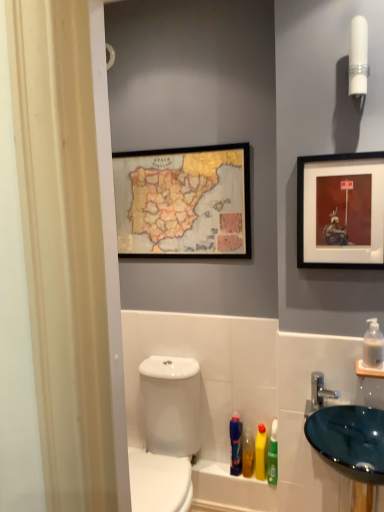
The width and height of the screenshot is (384, 512). I want to click on translucent green mouthwash at lower right, arranged as the 4th mouthwash when viewed from the right, so click(236, 445).

Describe the element at coordinates (358, 61) in the screenshot. I see `white plastic tube at upper right` at that location.

Where is `white plastic tube at upper right`? This screenshot has width=384, height=512. white plastic tube at upper right is located at coordinates (358, 61).

This screenshot has height=512, width=384. What do you see at coordinates (210, 389) in the screenshot? I see `white glossy toilet at lower left` at bounding box center [210, 389].

Where is `white glossy toilet at lower left`? The height and width of the screenshot is (512, 384). white glossy toilet at lower left is located at coordinates (210, 389).

Where is `matte black picture frame at upper right, the first picture frame in the front-to-back sequence`? The width and height of the screenshot is (384, 512). matte black picture frame at upper right, the first picture frame in the front-to-back sequence is located at coordinates (340, 211).

What do you see at coordinates (340, 211) in the screenshot? This screenshot has height=512, width=384. I see `matte black picture frame at upper right, acting as the second picture frame starting from the back` at bounding box center [340, 211].

Image resolution: width=384 pixels, height=512 pixels. Identify the location of translucent plastic mouthwash at lower right, which is the second mouthwash in left-to-right order. (248, 454).

Where is `translucent green mouthwash at lower right, acting as the 2th mouthwash starting from the back`? This screenshot has height=512, width=384. translucent green mouthwash at lower right, acting as the 2th mouthwash starting from the back is located at coordinates (236, 445).

Which is in front, clear plastic pump at right, the fourth mouthwash from the bottom, or green plastic mouthwash at lower center, the 3th mouthwash in the left-to-right sequence?

clear plastic pump at right, the fourth mouthwash from the bottom.

Between clear plastic pump at right, the fourth mouthwash in the left-to-right sequence, and green plastic mouthwash at lower center, the 2th mouthwash viewed from the right, which one has larger width?

Wider between the two is green plastic mouthwash at lower center, the 2th mouthwash viewed from the right.

Which is more to the right, clear plastic pump at right, the fourth mouthwash in the left-to-right sequence, or green plastic mouthwash at lower center, positioned as the 2th mouthwash in front-to-back order?

clear plastic pump at right, the fourth mouthwash in the left-to-right sequence, is more to the right.

Who is shorter, clear plastic pump at right, the fourth mouthwash from the bottom, or green plastic mouthwash at lower center, the 2th mouthwash viewed from the right?

With less height is clear plastic pump at right, the fourth mouthwash from the bottom.

Who is taller, green plastic mouthwash at lower center, the 2th mouthwash viewed from the right, or yellow matte bottle at lower center?

green plastic mouthwash at lower center, the 2th mouthwash viewed from the right, is taller.

Would you consider green plastic mouthwash at lower center, positioned as the third mouthwash in back-to-front order, to be distant from yellow matte bottle at lower center?

No, green plastic mouthwash at lower center, positioned as the third mouthwash in back-to-front order, is not far from yellow matte bottle at lower center.

The image size is (384, 512). Identify the location of cleaning product located below the green plastic mouthwash at lower center, positioned as the third mouthwash in back-to-front order (from the image's perspective). (260, 452).

Considering the positions of objects green plastic mouthwash at lower center, the 3th mouthwash from the top, and yellow matte bottle at lower center in the image provided, who is in front, green plastic mouthwash at lower center, the 3th mouthwash from the top, or yellow matte bottle at lower center?

green plastic mouthwash at lower center, the 3th mouthwash from the top, is closer to the camera.

Who is smaller, clear plastic pump at right, positioned as the 1th mouthwash in top-to-bottom order, or white plastic tube at upper right?

clear plastic pump at right, positioned as the 1th mouthwash in top-to-bottom order, is smaller.

From the image's perspective, which is above, clear plastic pump at right, the first mouthwash in the front-to-back sequence, or white plastic tube at upper right?

white plastic tube at upper right.

Looking at this image, considering the sizes of objects clear plastic pump at right, positioned as the 4th mouthwash in back-to-front order, and white plastic tube at upper right in the image provided, who is taller, clear plastic pump at right, positioned as the 4th mouthwash in back-to-front order, or white plastic tube at upper right?

With more height is white plastic tube at upper right.

Where is `the 1st mouthwash directly beneath the white plastic tube at upper right (from a real-world perspective)`? Image resolution: width=384 pixels, height=512 pixels. the 1st mouthwash directly beneath the white plastic tube at upper right (from a real-world perspective) is located at coordinates (373, 345).

Is point (269, 451) closer or farther from the camera than point (365, 79)?

Clearly, point (269, 451) is more distant from the camera than point (365, 79).

Locate an element on the screen. light fixture above the green plastic mouthwash at lower center, the 3th mouthwash from the top (from the image's perspective) is located at coordinates (358, 61).

Is green plastic mouthwash at lower center, positioned as the 2th mouthwash in front-to-back order, not close to white plastic tube at upper right?

Absolutely, green plastic mouthwash at lower center, positioned as the 2th mouthwash in front-to-back order, is distant from white plastic tube at upper right.

From the image's perspective, which is below, green plastic mouthwash at lower center, acting as the second mouthwash starting from the bottom, or white plastic tube at upper right?

green plastic mouthwash at lower center, acting as the second mouthwash starting from the bottom, appears lower in the image.

From the picture: From their relative heights in the image, would you say yellow matte bottle at lower center is taller or shorter than wooden framed map at upper center, marked as the 2th picture frame in a front-to-back arrangement?

In the image, yellow matte bottle at lower center appears to be shorter than wooden framed map at upper center, marked as the 2th picture frame in a front-to-back arrangement.

Is yellow matte bottle at lower center at the left side of wooden framed map at upper center, marked as the 2th picture frame in a front-to-back arrangement?

Incorrect, yellow matte bottle at lower center is not on the left side of wooden framed map at upper center, marked as the 2th picture frame in a front-to-back arrangement.

Consider the image. Relative to wooden framed map at upper center, arranged as the 2th picture frame when viewed from the right, is yellow matte bottle at lower center in front or behind?

Visually, yellow matte bottle at lower center is located behind wooden framed map at upper center, arranged as the 2th picture frame when viewed from the right.

Locate an element on the screen. The image size is (384, 512). the 1st picture frame in front of the yellow matte bottle at lower center is located at coordinates (184, 202).

From a real-world perspective, between wooden framed map at upper center, marked as the 2th picture frame in a front-to-back arrangement, and translucent plastic mouthwash at lower right, which is the second mouthwash in left-to-right order, who is vertically higher?

In real-world perspective, wooden framed map at upper center, marked as the 2th picture frame in a front-to-back arrangement, is above.

Is wooden framed map at upper center, marked as the 2th picture frame in a front-to-back arrangement, facing towards translucent plastic mouthwash at lower right, which is counted as the 3th mouthwash, starting from the right?

No, wooden framed map at upper center, marked as the 2th picture frame in a front-to-back arrangement, is not facing towards translucent plastic mouthwash at lower right, which is counted as the 3th mouthwash, starting from the right.

Does wooden framed map at upper center, marked as the 2th picture frame in a front-to-back arrangement, lie in front of translucent plastic mouthwash at lower right, which is the second mouthwash in left-to-right order?

That is True.

Would you say wooden framed map at upper center, which appears as the 1th picture frame when viewed from the left, is to the left or to the right of translucent plastic mouthwash at lower right, marked as the fourth mouthwash in a top-to-bottom arrangement, in the picture?

Based on their positions, wooden framed map at upper center, which appears as the 1th picture frame when viewed from the left, is located to the left of translucent plastic mouthwash at lower right, marked as the fourth mouthwash in a top-to-bottom arrangement.

Is point (373, 355) farther from viewer compared to point (240, 456)?

No, it is in front of (240, 456).

Where is `mouthwash that is the 1st object directly below the clear plastic pump at right, the fourth mouthwash in the left-to-right sequence (from a real-world perspective)`? Image resolution: width=384 pixels, height=512 pixels. mouthwash that is the 1st object directly below the clear plastic pump at right, the fourth mouthwash in the left-to-right sequence (from a real-world perspective) is located at coordinates (236, 445).

Looking at this image, from the image's perspective, is clear plastic pump at right, positioned as the 1th mouthwash in top-to-bottom order, positioned above or below translucent green mouthwash at lower right, acting as the 2th mouthwash starting from the back?

From the image's perspective, clear plastic pump at right, positioned as the 1th mouthwash in top-to-bottom order, appears above translucent green mouthwash at lower right, acting as the 2th mouthwash starting from the back.

Does clear plastic pump at right, the first mouthwash in the front-to-back sequence, have a greater width compared to translucent green mouthwash at lower right, placed as the third mouthwash when sorted from bottom to top?

In fact, clear plastic pump at right, the first mouthwash in the front-to-back sequence, might be narrower than translucent green mouthwash at lower right, placed as the third mouthwash when sorted from bottom to top.

Identify the location of mouthwash that is the 2nd one when counting downward from the clear plastic pump at right, positioned as the 4th mouthwash in back-to-front order (from the image's perspective). The height and width of the screenshot is (512, 384). (273, 455).

Where is `the 1st mouthwash in front of the yellow matte bottle at lower center`? This screenshot has height=512, width=384. the 1st mouthwash in front of the yellow matte bottle at lower center is located at coordinates (273, 455).

Looking at this image, based on their spatial positions, is wooden framed map at upper center, which appears as the 1th picture frame when viewed from the left, or clear plastic pump at right, positioned as the 1th mouthwash in top-to-bottom order, closer to white glossy toilet at lower left?

wooden framed map at upper center, which appears as the 1th picture frame when viewed from the left, is positioned closer to the anchor white glossy toilet at lower left.

Consider the image. From the image, which object appears to be farther from white glossy toilet at lower left, white plastic tube at upper right or green plastic mouthwash at lower center, positioned as the third mouthwash in back-to-front order?

Among the two, white plastic tube at upper right is located further to white glossy toilet at lower left.

From the image, which object appears to be farther from translucent plastic mouthwash at lower right, which is counted as the 3th mouthwash, starting from the right, wooden framed map at upper center, arranged as the 2th picture frame when viewed from the right, or translucent green mouthwash at lower right, arranged as the 2th mouthwash when viewed from the top?

The object further to translucent plastic mouthwash at lower right, which is counted as the 3th mouthwash, starting from the right, is wooden framed map at upper center, arranged as the 2th picture frame when viewed from the right.

Looking at the image, which one is located closer to matte black picture frame at upper right, the first picture frame in the front-to-back sequence, white plastic tube at upper right or clear plastic pump at right, the fourth mouthwash from the bottom?

The object closer to matte black picture frame at upper right, the first picture frame in the front-to-back sequence, is white plastic tube at upper right.

Considering their positions, is matte black picture frame at upper right, which is the 2th picture frame in left-to-right order, positioned further to wooden framed map at upper center, arranged as the 2th picture frame when viewed from the right, than yellow matte bottle at lower center?

yellow matte bottle at lower center.

When comparing their distances from yellow matte bottle at lower center, does glossy glass sink at lower right or clear plastic pump at right, the fourth mouthwash from the bottom, seem further?

clear plastic pump at right, the fourth mouthwash from the bottom.

Which object lies further to the anchor point white glossy toilet at lower left, wooden framed map at upper center, which appears as the 1th picture frame when viewed from the left, or white plastic tube at upper right?

The object further to white glossy toilet at lower left is white plastic tube at upper right.

Looking at the image, which one is located further to wooden framed map at upper center, which appears as the 1th picture frame when viewed from the left, glossy glass sink at lower right or clear plastic pump at right, positioned as the 4th mouthwash in back-to-front order?

glossy glass sink at lower right is further to wooden framed map at upper center, which appears as the 1th picture frame when viewed from the left.

Locate an element on the screen. picture frame between wooden framed map at upper center, marked as the 2th picture frame in a front-to-back arrangement, and white glossy toilet at lower left from top to bottom is located at coordinates (340, 211).

Identify the location of mouthwash between matte black picture frame at upper right, acting as the second picture frame starting from the back, and glossy glass sink at lower right vertically. This screenshot has height=512, width=384. (373, 345).

At what (x,y) coordinates should I click in order to perform the action: click on cleaning product between white glossy toilet at lower left and green plastic mouthwash at lower center, the 3th mouthwash from the top, from left to right. Please return your answer as a coordinate pair (x, y). The height and width of the screenshot is (512, 384). Looking at the image, I should click on (260, 452).

The image size is (384, 512). In order to click on bath between white glossy toilet at lower left and translucent plastic mouthwash at lower right, arranged as the fourth mouthwash when viewed from the front, from front to back in this screenshot , I will do `click(210, 389)`.